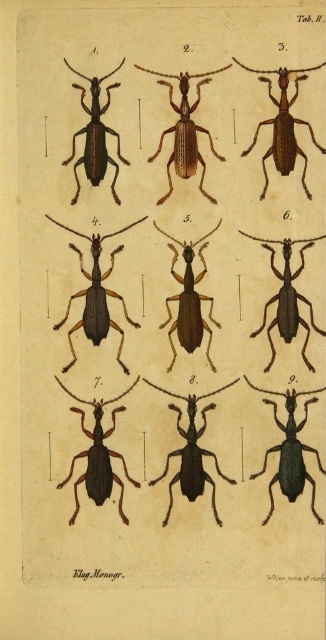
Which is behind, point (86, 432) or point (188, 102)?

The point (86, 432) is more distant.

Is point (95, 417) positioned before point (179, 164)?

No, (95, 417) is further to viewer.

At what (x,y) coordinates should I click in order to perform the action: click on matte black beetle at lower left. Please return your answer as a coordinate pair (x, y). This screenshot has width=326, height=640. Looking at the image, I should click on click(x=98, y=458).

Can you confirm if matte black beetle at center right is positioned to the right of matte black beetle at lower left?

Correct, you'll find matte black beetle at center right to the right of matte black beetle at lower left.

Is point (286, 449) closer to viewer compared to point (115, 412)?

Yes, point (286, 449) is in front of point (115, 412).

Consider the image. Who is more forward, (284,480) or (74,461)?

Point (284,480)

You are a GUI agent. You are given a task and a screenshot of the screen. Output one action in this format:
    pyautogui.click(x=<x>, y=<y>)
    Task: Click on the matte black beetle at center right
    The height and width of the screenshot is (640, 326).
    Given the screenshot: What is the action you would take?
    pyautogui.click(x=290, y=451)

Is black matte beetle at center taller than brown matte beetle at center?

Incorrect, black matte beetle at center's height is not larger of brown matte beetle at center's.

Consider the image. Who is higher up, black matte beetle at center or brown matte beetle at center?

brown matte beetle at center is above.

Who is more distant from viewer, (x=149, y=484) or (x=181, y=326)?

The point (x=149, y=484) is behind.

Locate an element on the screen. black matte beetle at center is located at coordinates (191, 452).